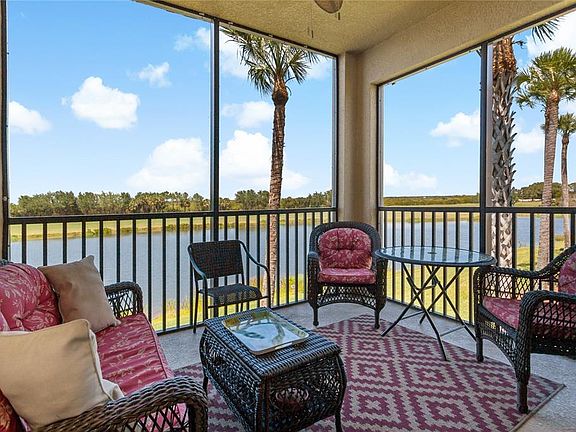
The image size is (576, 432). In order to click on chair in this screenshot , I will do `click(552, 319)`, `click(344, 272)`, `click(229, 289)`.